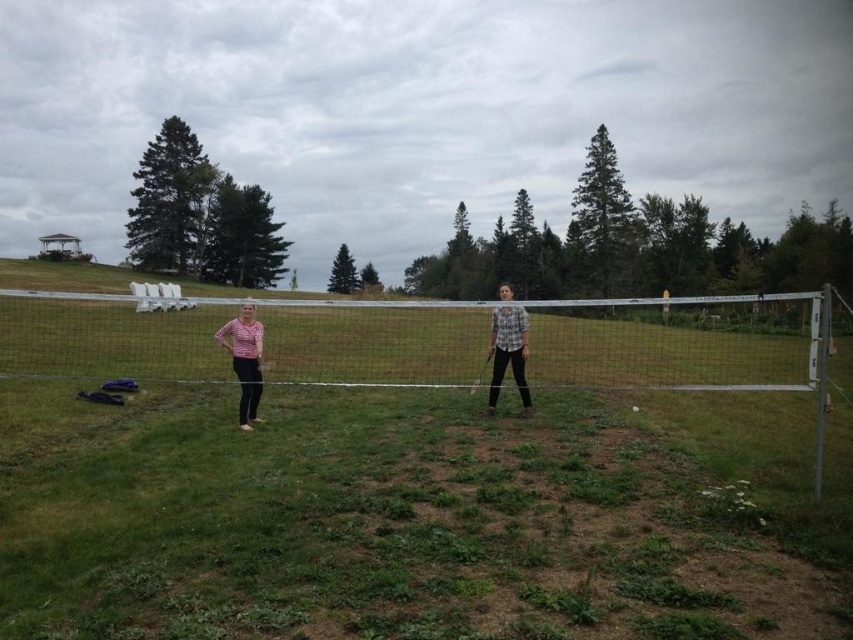
You are a photographer standing behind the person on the left. You want to take a photo of the plaid shirt at center without the white mesh net at center blocking the view. Is it possible to do so from your current position?

The white mesh net at center is above the plaid shirt at center, so the net is positioned higher than the shirt. Since you are standing behind the person on the left, you can angle your camera downward to capture the plaid shirt at center without the net obstructing the view.

You are standing at the center of the volleyball net in the grassy field. You see two points marked in the scene. Which point is closer to you, point (503, 330) or point (247, 365)?

Point (247, 365) is closer to you because it is less further to the viewer than point (503, 330).